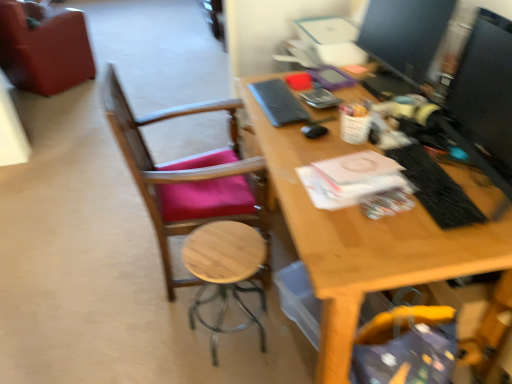
Question: From the image's perspective, is wooden stool at center located above or below velvet-like red chair at upper left, marked as the 1th chair in a left-to-right arrangement?

Choices:
 (A) above
 (B) below

Answer: (B)

Question: In terms of width, does wooden stool at center look wider or thinner when compared to velvet-like red chair at upper left, arranged as the first chair when viewed from the back?

Choices:
 (A) wide
 (B) thin

Answer: (B)

Question: Which of these objects is positioned closest to the wooden chair at left, acting as the second chair starting from the back?

Choices:
 (A) matte black monitor at upper right
 (B) wooden stool at center
 (C) black textured laptop keyboard at right
 (D) velvet-like red chair at upper left, which is the 2th chair in bottom-to-top order

Answer: (B)

Question: Based on their relative distances, which object is farther from the black textured laptop keyboard at right?

Choices:
 (A) wooden stool at center
 (B) wooden chair at left, marked as the 1th chair in a right-to-left arrangement
 (C) matte black monitor at upper right
 (D) velvet-like red chair at upper left, the second chair in the front-to-back sequence

Answer: (D)